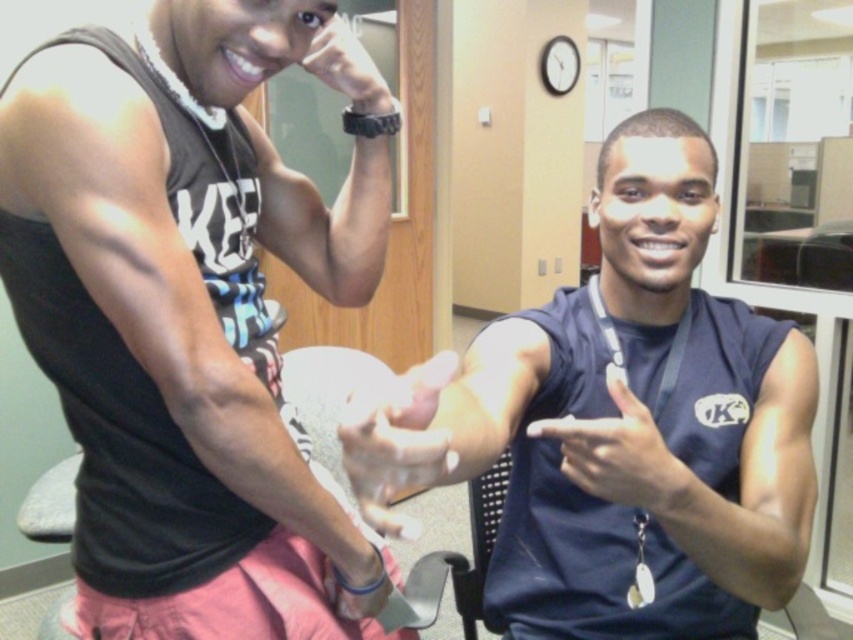
You are taking a photo of two people in an office. The first person is at point (579, 298) and the second is at point (323, 51). Which point is closer to the camera?

Point (323, 51) is closer to the camera because it is less further than point (579, 298).

You are an office security system that needs to identify the nearest object to the camera. You see the navy blue sleeveless shirt at center and the matte black hand at center. Which one is closer to the camera?

The navy blue sleeveless shirt at center is closer to the viewer than the matte black hand at center, so the navy blue sleeveless shirt at center is the nearest object to the camera.

From the picture: You are standing in an office and see a point marked at coordinates (601, 493). If you want to take a photo of this point with a camera that has a 24mm focal length, what is the approximate distance in inches you should maintain to ensure the point is in focus?

The point at coordinates (601, 493) is 29.88 inches away from the camera. To ensure the point is in focus, you should maintain a distance of approximately 29.88 inches from the camera to the point.